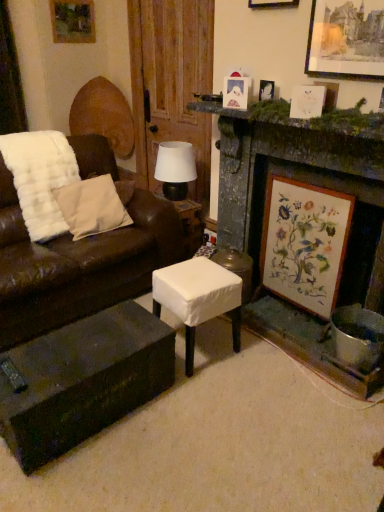
Locate an element on the screen. Image resolution: width=384 pixels, height=512 pixels. free space in front of dark wood coffee table at lower center is located at coordinates (91, 476).